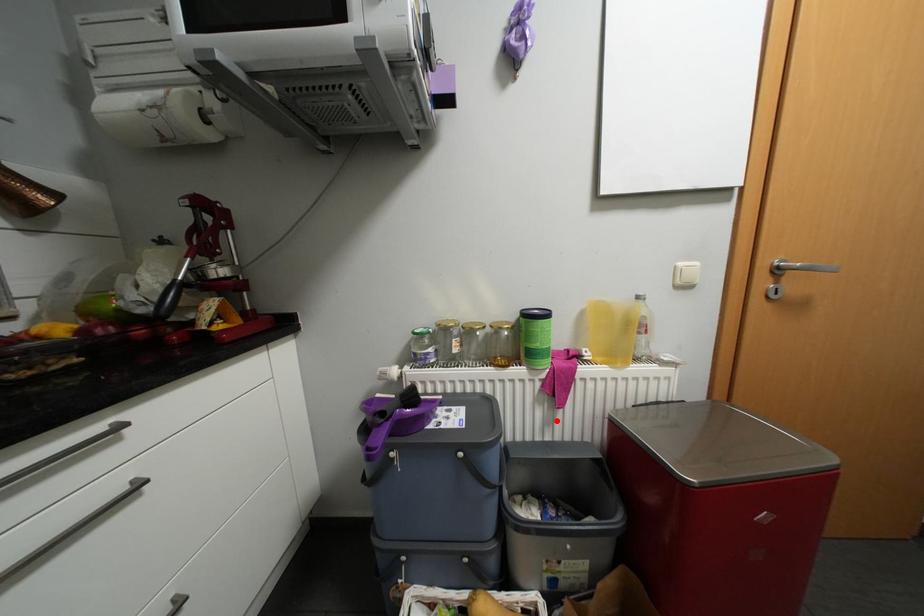
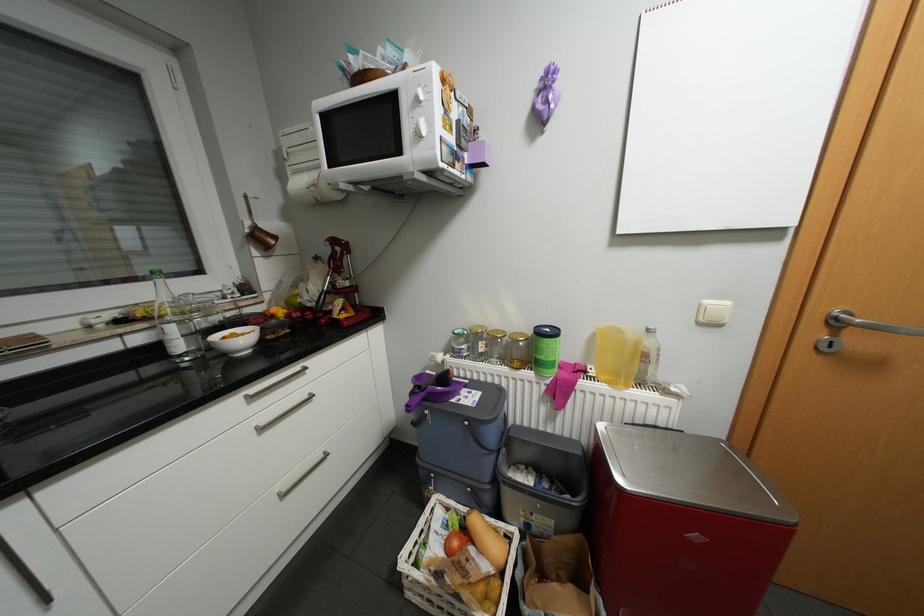
Where in the second image is the point corresponding to the highlighted location from the first image?

(558, 416)